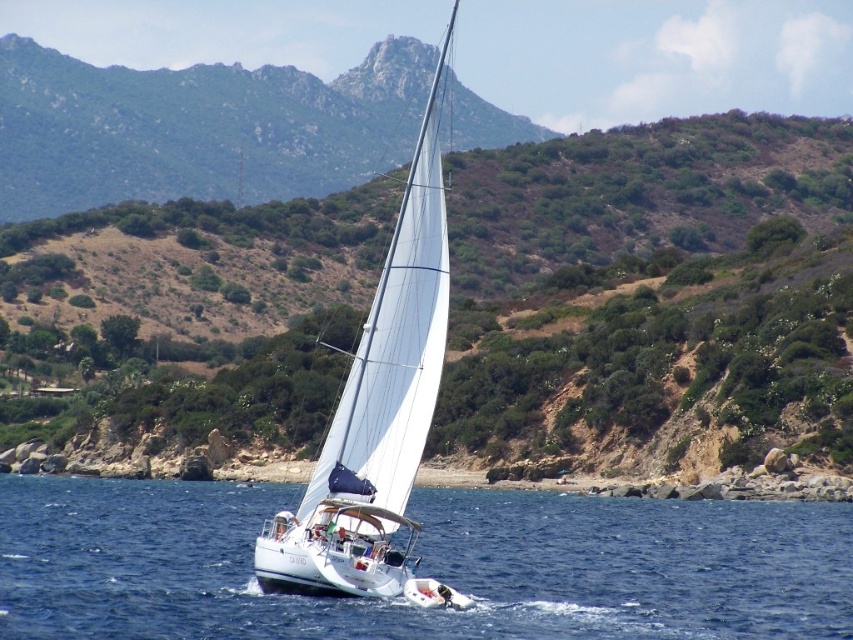
Question: Which of the following is the closest to the observer?

Choices:
 (A) (440, 56)
 (B) (631, 157)
 (C) (752, 612)

Answer: (C)

Question: From the image, what is the correct spatial relationship of green shrubbery at center in relation to white sailboat at center?

Choices:
 (A) right
 (B) left

Answer: (A)

Question: Can you confirm if blue water at center is positioned above white sailboat at center?

Choices:
 (A) yes
 (B) no

Answer: (B)

Question: Which object is farther from the camera taking this photo?

Choices:
 (A) green shrubbery at center
 (B) blue water at center
 (C) white sailboat at center

Answer: (A)

Question: Is blue water at center to the left of white sailboat at center from the viewer's perspective?

Choices:
 (A) no
 (B) yes

Answer: (A)

Question: Which object is the farthest from the green shrubbery at center?

Choices:
 (A) blue water at center
 (B) white sailboat at center

Answer: (B)